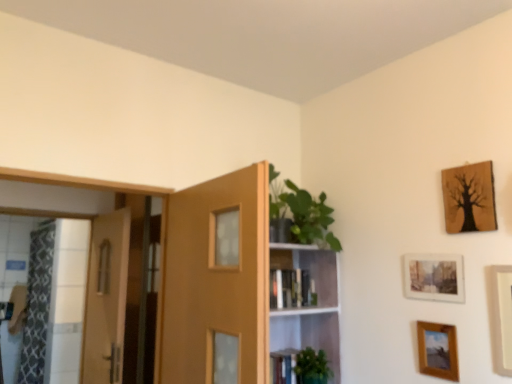
Question: Is the position of green glossy plant at upper center more distant than that of green matte plant at lower center?

Choices:
 (A) no
 (B) yes

Answer: (A)

Question: Is green glossy plant at upper center not close to green matte plant at lower center?

Choices:
 (A) yes
 (B) no

Answer: (B)

Question: Is green matte plant at lower center a part of green glossy plant at upper center?

Choices:
 (A) no
 (B) yes

Answer: (B)

Question: Is green glossy plant at upper center facing towards green matte plant at lower center?

Choices:
 (A) yes
 (B) no

Answer: (A)

Question: Can you confirm if green glossy plant at upper center is positioned to the left of green matte plant at lower center?

Choices:
 (A) no
 (B) yes

Answer: (B)

Question: Based on their sizes in the image, would you say green matte plant at lower center is bigger or smaller than white matte picture frame at right, the 2th picture frame from the bottom?

Choices:
 (A) big
 (B) small

Answer: (A)

Question: From a real-world perspective, is green matte plant at lower center physically located above or below white matte picture frame at right, the 3th picture frame when ordered from top to bottom?

Choices:
 (A) above
 (B) below

Answer: (B)

Question: Is point (300, 364) positioned closer to the camera than point (502, 304)?

Choices:
 (A) farther
 (B) closer

Answer: (A)

Question: In terms of height, does green matte plant at lower center look taller or shorter compared to white matte picture frame at right, the 2th picture frame from the bottom?

Choices:
 (A) short
 (B) tall

Answer: (A)

Question: Considering the positions of wooden picture frame at lower right, the 1th picture frame ordered from the bottom, and patterned fabric shower curtain at left in the image, is wooden picture frame at lower right, the 1th picture frame ordered from the bottom, taller or shorter than patterned fabric shower curtain at left?

Choices:
 (A) short
 (B) tall

Answer: (A)

Question: Considering the relative positions of wooden picture frame at lower right, positioned as the 4th picture frame in top-to-bottom order, and patterned fabric shower curtain at left in the image provided, is wooden picture frame at lower right, positioned as the 4th picture frame in top-to-bottom order, to the left or to the right of patterned fabric shower curtain at left?

Choices:
 (A) right
 (B) left

Answer: (A)

Question: Would you say wooden picture frame at lower right, the 1th picture frame ordered from the bottom, is inside or outside patterned fabric shower curtain at left?

Choices:
 (A) inside
 (B) outside

Answer: (B)

Question: Is wooden picture frame at lower right, positioned as the 4th picture frame in top-to-bottom order, wider or thinner than patterned fabric shower curtain at left?

Choices:
 (A) wide
 (B) thin

Answer: (B)

Question: Is patterned fabric shower curtain at left bigger or smaller than green matte plant at lower center?

Choices:
 (A) big
 (B) small

Answer: (A)

Question: From a real-world perspective, is patterned fabric shower curtain at left physically located above or below green matte plant at lower center?

Choices:
 (A) above
 (B) below

Answer: (A)